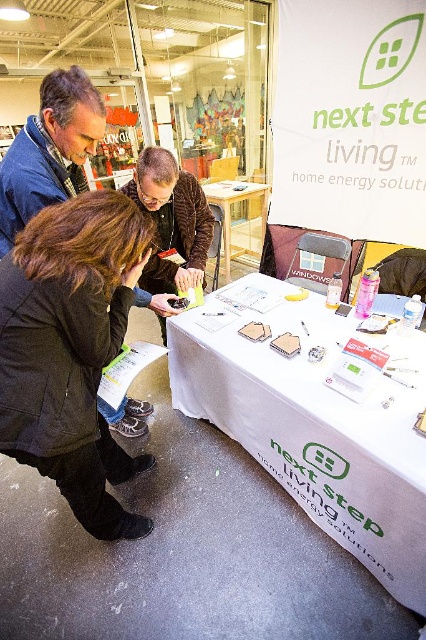
You are attending the trade show and need to place a new promotional item on the table. The item is the size of the dark brown leather jacket at lower left. Is there enough space on the table next to the white paper at center?

The white paper at center is larger in size than the dark brown leather jacket at lower left. Since the white paper at center is already occupying a significant portion of the table, there might not be enough space next to it for the promotional item of the same size as the dark brown leather jacket at lower left.

You are at the Next Step Living home energy solutions booth and need to retrieve an item from the table. The item is located at point A, which is at coordinates point (324, 385), and another item is at point B, point (236, 184). Which item is closer to you?

The item at point (324, 385) is closer to you because it is in front of point (236, 184).

Looking at this image, you are a visitor at the trade show and you want to grab both jackets from the dark brown leather jacket at lower left to the blue denim jacket at upper left. Can you reach both jackets without moving your position?

The distance between dark brown leather jacket at lower left and blue denim jacket at upper left is 49.66 centimeters, so if your reach can cover that distance, you can grab both jackets without moving your position.